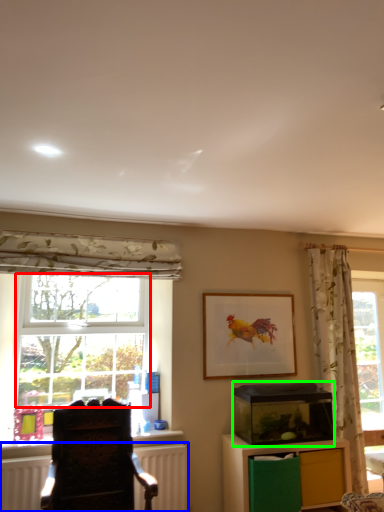
Question: Considering the real-world distances, which object is farthest from bay window (highlighted by a red box)? radiator (highlighted by a blue box) or appliance (highlighted by a green box)?

Choices:
 (A) radiator
 (B) appliance

Answer: (B)